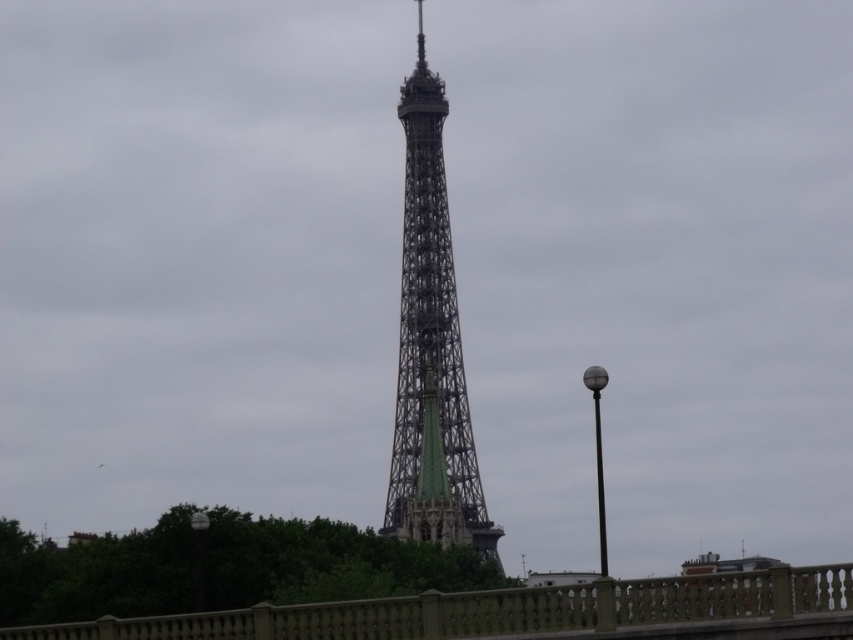
Is beige stone fence at lower center thinner than metallic lattice tower at center?

In fact, beige stone fence at lower center might be wider than metallic lattice tower at center.

Find the location of a particular element. beige stone fence at lower center is located at coordinates (519, 611).